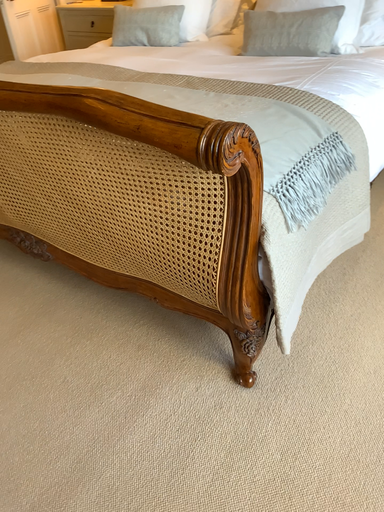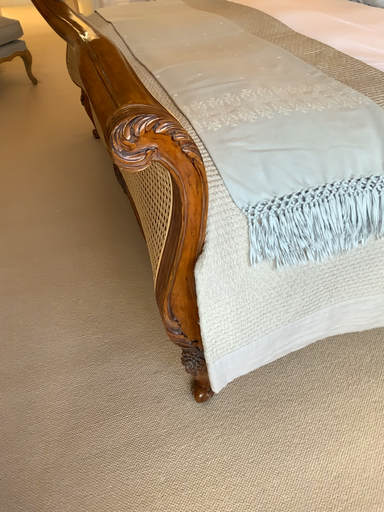
Question: Which way did the camera rotate in the video?

Choices:
 (A) rotated left
 (B) rotated right

Answer: (A)